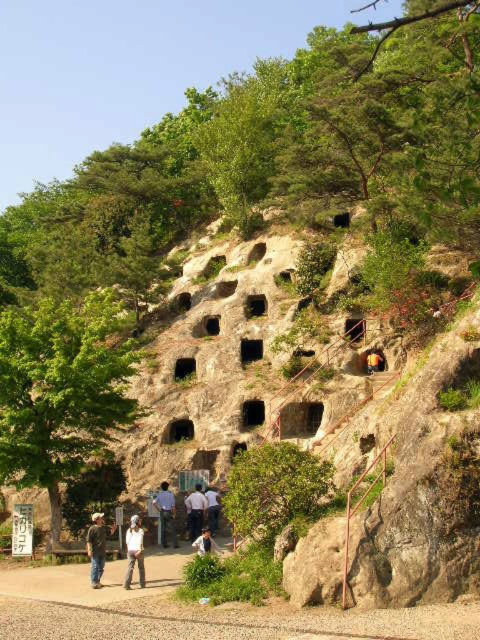
You are standing on the rocky hillside and want to hide behind an object to avoid being seen. Which object between the green leafy tree at left and the white cotton shirt at center would provide a wider coverage area?

The green leafy tree at left has a larger width than the white cotton shirt at center, so it would provide a wider coverage area for hiding.

You are standing at the base of the rocky hillside and notice two items on the ground ahead of you. The white cotton shirt at lower center and the yellow fabric at center. Which item is closer to you?

The white cotton shirt at lower center is taller than the yellow fabric at center, so it is closer to you.